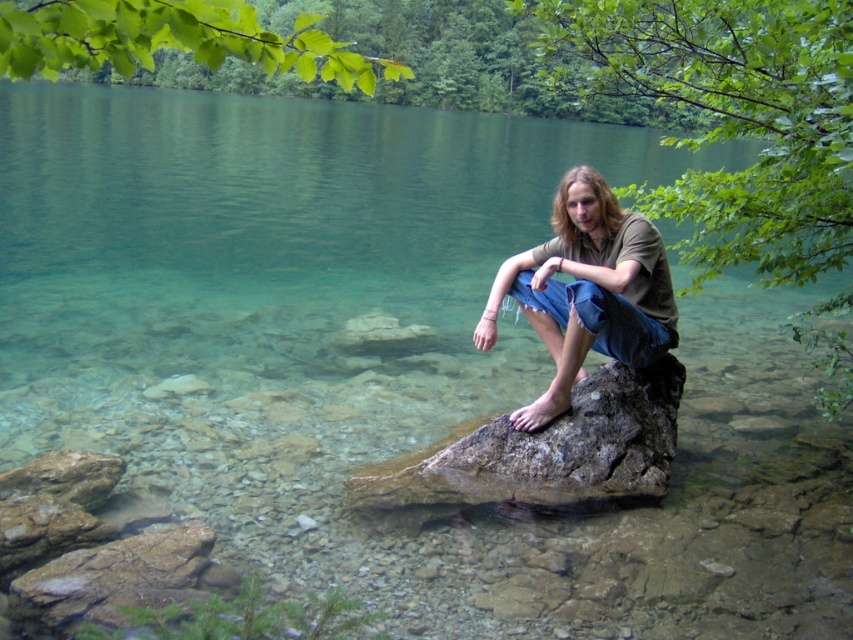
Question: Is brown cotton shirt at center bigger than brown rough rock at lower left?

Choices:
 (A) no
 (B) yes

Answer: (B)

Question: Which point appears farthest from the camera in this image?

Choices:
 (A) (515, 275)
 (B) (142, 548)

Answer: (A)

Question: Can you confirm if brown cotton shirt at center is positioned above brown rough rock at lower left?

Choices:
 (A) no
 (B) yes

Answer: (B)

Question: Does brown cotton shirt at center appear on the left side of brown rough rock at lower left?

Choices:
 (A) no
 (B) yes

Answer: (A)

Question: Which object appears closest to the camera in this image?

Choices:
 (A) brown rough rock at lower left
 (B) brown cotton shirt at center

Answer: (A)